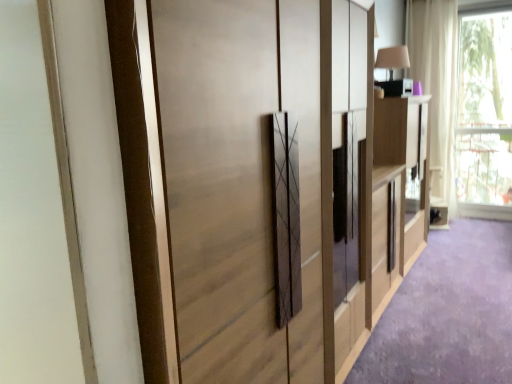
Locate an element on the screen. The image size is (512, 384). transparent glass window at upper right is located at coordinates [x=484, y=115].

The height and width of the screenshot is (384, 512). Find the location of `transparent glass window at upper right`. transparent glass window at upper right is located at coordinates click(x=484, y=115).

Is white sheer curtain at upper right closer to camera compared to light wood cabinet at right?

No, it is not.

Measure the distance from white sheer curtain at upper right to light wood cabinet at right.

A distance of 1.57 meters exists between white sheer curtain at upper right and light wood cabinet at right.

Is point (438, 174) positioned after point (387, 152)?

Yes, point (438, 174) is farther from viewer.

Is white sheer curtain at upper right not inside light wood cabinet at right?

Yes, white sheer curtain at upper right is not within light wood cabinet at right.

Is matte wood cupboard at center oriented away from matte beige table lamp at upper right?

No, matte wood cupboard at center is not facing away from matte beige table lamp at upper right.

From the image's perspective, which is below, matte wood cupboard at center or matte beige table lamp at upper right?

From the image's view, matte wood cupboard at center is below.

Can you tell me how much matte wood cupboard at center and matte beige table lamp at upper right differ in facing direction?

There is a 0.168-degree angle between the facing directions of matte wood cupboard at center and matte beige table lamp at upper right.

Which object is further away from the camera, matte wood cupboard at center or matte beige table lamp at upper right?

Positioned behind is matte beige table lamp at upper right.

In the scene shown: Considering the relative positions of matte beige table lamp at upper right and transparent glass window at upper right in the image provided, is matte beige table lamp at upper right to the left or to the right of transparent glass window at upper right?

From the image, it's evident that matte beige table lamp at upper right is to the left of transparent glass window at upper right.

Consider the image. Which object is further away from the camera taking this photo, matte beige table lamp at upper right or transparent glass window at upper right?

transparent glass window at upper right is further from the camera.

Between matte beige table lamp at upper right and transparent glass window at upper right, which one has smaller width?

Thinner between the two is transparent glass window at upper right.

Considering the sizes of matte beige table lamp at upper right and transparent glass window at upper right in the image, is matte beige table lamp at upper right taller or shorter than transparent glass window at upper right?

In the image, matte beige table lamp at upper right appears to be shorter than transparent glass window at upper right.

Does light wood cabinet at right turn towards matte wood cupboard at center?

No, light wood cabinet at right is not turned towards matte wood cupboard at center.

Which object is closer to the camera, light wood cabinet at right or matte wood cupboard at center?

matte wood cupboard at center.

Is light wood cabinet at right next to matte wood cupboard at center?

There is a gap between light wood cabinet at right and matte wood cupboard at center.

From a real-world perspective, is light wood cabinet at right above or below matte wood cupboard at center?

Clearly, from a real-world perspective, light wood cabinet at right is below matte wood cupboard at center.

Can you tell me how much transparent glass window at upper right and matte wood cupboard at center differ in facing direction?

91.2 degrees separate the facing orientations of transparent glass window at upper right and matte wood cupboard at center.

Who is smaller, transparent glass window at upper right or matte wood cupboard at center?

transparent glass window at upper right.

Could you tell me if transparent glass window at upper right is facing matte wood cupboard at center?

Yes, transparent glass window at upper right is oriented towards matte wood cupboard at center.

Identify the location of cupboard that is under the transparent glass window at upper right (from a real-world perspective). This screenshot has height=384, width=512. (272, 188).

From a real-world perspective, is matte beige table lamp at upper right located higher than light wood cabinet at right?

Yes.

Considering the sizes of matte beige table lamp at upper right and light wood cabinet at right in the image, is matte beige table lamp at upper right wider or thinner than light wood cabinet at right?

Clearly, matte beige table lamp at upper right has less width compared to light wood cabinet at right.

Does matte beige table lamp at upper right touch light wood cabinet at right?

No.

Is matte beige table lamp at upper right outside of light wood cabinet at right?

That's correct, matte beige table lamp at upper right is outside of light wood cabinet at right.

Considering the sizes of white sheer curtain at upper right and transparent glass window at upper right in the image, is white sheer curtain at upper right wider or thinner than transparent glass window at upper right?

A: Considering their sizes, white sheer curtain at upper right looks broader than transparent glass window at upper right.

From a real-world perspective, is white sheer curtain at upper right physically below transparent glass window at upper right?

Actually, white sheer curtain at upper right is physically above transparent glass window at upper right in the real world.

Does point (456, 66) appear closer or farther from the camera than point (470, 179)?

Point (456, 66) appears to be closer to the viewer than point (470, 179).

The width and height of the screenshot is (512, 384). In the image, there is a white sheer curtain at upper right. In order to click on window below it (from the image's perspective) in this screenshot , I will do `click(484, 115)`.

Where is `curtain lying above the light wood cabinet at right (from the image's perspective)`? curtain lying above the light wood cabinet at right (from the image's perspective) is located at coordinates (437, 86).

Where is `cupboard below the matte beige table lamp at upper right (from the image's perspective)`? cupboard below the matte beige table lamp at upper right (from the image's perspective) is located at coordinates (272, 188).

Which object lies further to the anchor point matte beige table lamp at upper right, white sheer curtain at upper right or light wood cabinet at right?

white sheer curtain at upper right.

When comparing their distances from transparent glass window at upper right, does matte beige table lamp at upper right or white sheer curtain at upper right seem closer?

Based on the image, white sheer curtain at upper right appears to be nearer to transparent glass window at upper right.

Looking at the image, which one is located further to light wood cabinet at right, transparent glass window at upper right or matte beige table lamp at upper right?

The object further to light wood cabinet at right is transparent glass window at upper right.

Looking at the image, which one is located closer to light wood cabinet at right, matte wood cupboard at center or white sheer curtain at upper right?

Among the two, matte wood cupboard at center is located nearer to light wood cabinet at right.

Based on their spatial positions, is light wood cabinet at right or white sheer curtain at upper right closer to matte wood cupboard at center?

light wood cabinet at right is positioned closer to the anchor matte wood cupboard at center.

Which object lies further to the anchor point light wood cabinet at right, matte beige table lamp at upper right or matte wood cupboard at center?

Based on the image, matte wood cupboard at center appears to be further to light wood cabinet at right.

Considering their positions, is matte wood cupboard at center positioned closer to transparent glass window at upper right than white sheer curtain at upper right?

white sheer curtain at upper right.

Looking at the image, which one is located closer to matte wood cupboard at center, matte beige table lamp at upper right or light wood cabinet at right?

light wood cabinet at right is positioned closer to the anchor matte wood cupboard at center.

You are a GUI agent. You are given a task and a screenshot of the screen. Output one action in this format:
    pyautogui.click(x=<x>, y=<y>)
    Task: Click on the cabinetry located between matte wood cupboard at center and transparent glass window at upper right in the depth direction
    The height and width of the screenshot is (384, 512).
    Given the screenshot: What is the action you would take?
    pyautogui.click(x=398, y=191)

Identify the location of table lamp between light wood cabinet at right and white sheer curtain at upper right along the z-axis. (392, 70).

The image size is (512, 384). I want to click on curtain located between matte beige table lamp at upper right and transparent glass window at upper right in the left-right direction, so click(437, 86).

Where is `table lamp situated between light wood cabinet at right and transparent glass window at upper right from left to right`? The width and height of the screenshot is (512, 384). table lamp situated between light wood cabinet at right and transparent glass window at upper right from left to right is located at coordinates (392, 70).